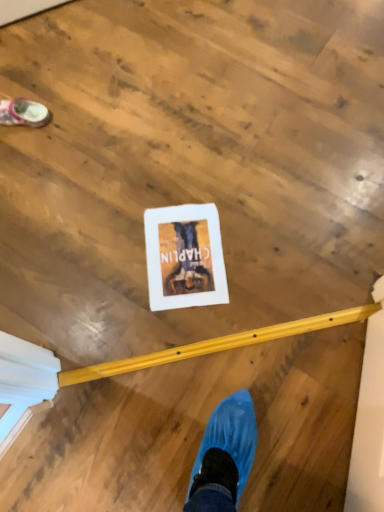
Question: Looking at the image, does white fabric shoe at upper left seem bigger or smaller compared to white paper at center?

Choices:
 (A) small
 (B) big

Answer: (B)

Question: Relative to white paper at center, is white fabric shoe at upper left in front or behind?

Choices:
 (A) behind
 (B) front

Answer: (A)

Question: Would you say white fabric shoe at upper left is inside or outside white paper at center?

Choices:
 (A) inside
 (B) outside

Answer: (B)

Question: Does point (218, 289) appear closer or farther from the camera than point (19, 121)?

Choices:
 (A) closer
 (B) farther

Answer: (A)

Question: Considering their positions, is white paper at center located in front of or behind white fabric shoe at upper left?

Choices:
 (A) front
 (B) behind

Answer: (A)

Question: From a real-world perspective, is white paper at center positioned above or below white fabric shoe at upper left?

Choices:
 (A) above
 (B) below

Answer: (B)

Question: Considering the relative positions of white paper at center and white fabric shoe at upper left in the image provided, is white paper at center to the left or to the right of white fabric shoe at upper left?

Choices:
 (A) right
 (B) left

Answer: (A)